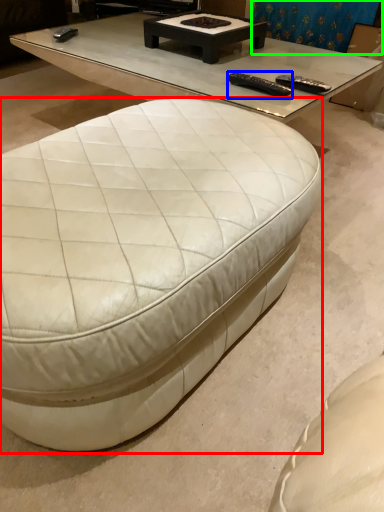
Question: Estimate the real-world distances between objects in this image. Which object is closer to coffee table (highlighted by a red box), remote (highlighted by a blue box) or curtain (highlighted by a green box)?

Choices:
 (A) remote
 (B) curtain

Answer: (A)